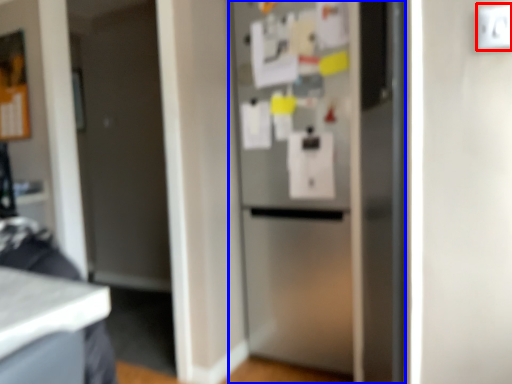
Question: Which object is closer to the camera taking this photo, electric outlet (highlighted by a red box) or refrigerator (highlighted by a blue box)?

Choices:
 (A) electric outlet
 (B) refrigerator

Answer: (A)